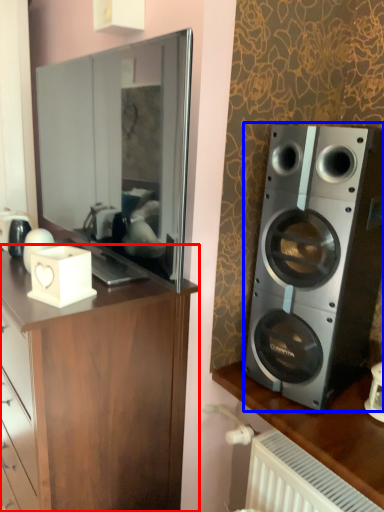
Question: Which object appears closest to the camera in this image, cabinetry (highlighted by a red box) or speaker (highlighted by a blue box)?

Choices:
 (A) cabinetry
 (B) speaker

Answer: (A)